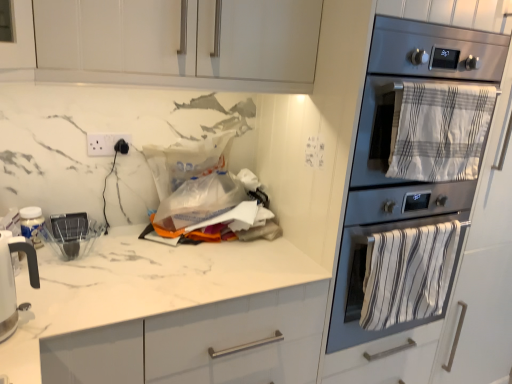
Question: Is white glossy cabinet at upper center bigger than white marble countertop at center?

Choices:
 (A) no
 (B) yes

Answer: (A)

Question: Is white glossy cabinet at upper center oriented away from white marble countertop at center?

Choices:
 (A) yes
 (B) no

Answer: (B)

Question: From the image's perspective, is white glossy cabinet at upper center on white marble countertop at center?

Choices:
 (A) yes
 (B) no

Answer: (A)

Question: Does white glossy cabinet at upper center come behind white marble countertop at center?

Choices:
 (A) yes
 (B) no

Answer: (A)

Question: Is white glossy cabinet at upper center smaller than white marble countertop at center?

Choices:
 (A) no
 (B) yes

Answer: (B)

Question: In the image, is white glossy electric kettle at left on the left side or the right side of white glossy cabinet at upper center?

Choices:
 (A) left
 (B) right

Answer: (A)

Question: Considering the positions of white glossy electric kettle at left and white glossy cabinet at upper center in the image, is white glossy electric kettle at left taller or shorter than white glossy cabinet at upper center?

Choices:
 (A) tall
 (B) short

Answer: (B)

Question: Looking at the image, does white glossy electric kettle at left seem bigger or smaller compared to white glossy cabinet at upper center?

Choices:
 (A) big
 (B) small

Answer: (B)

Question: Is white glossy electric kettle at left in front of or behind white glossy cabinet at upper center in the image?

Choices:
 (A) behind
 (B) front

Answer: (B)

Question: From the image's perspective, is white glossy cabinet at upper center positioned above or below white marble countertop at center?

Choices:
 (A) above
 (B) below

Answer: (A)

Question: Relative to white marble countertop at center, is white glossy cabinet at upper center in front or behind?

Choices:
 (A) front
 (B) behind

Answer: (B)

Question: Considering the positions of white glossy cabinet at upper center and white marble countertop at center in the image, is white glossy cabinet at upper center bigger or smaller than white marble countertop at center?

Choices:
 (A) small
 (B) big

Answer: (A)

Question: From a real-world perspective, relative to white marble countertop at center, is white glossy cabinet at upper center vertically above or below?

Choices:
 (A) below
 (B) above

Answer: (B)

Question: Would you say stainless steel oven at right is inside or outside white glossy electric kettle at left?

Choices:
 (A) inside
 (B) outside

Answer: (B)

Question: From a real-world perspective, relative to white glossy electric kettle at left, is stainless steel oven at right vertically above or below?

Choices:
 (A) below
 (B) above

Answer: (B)